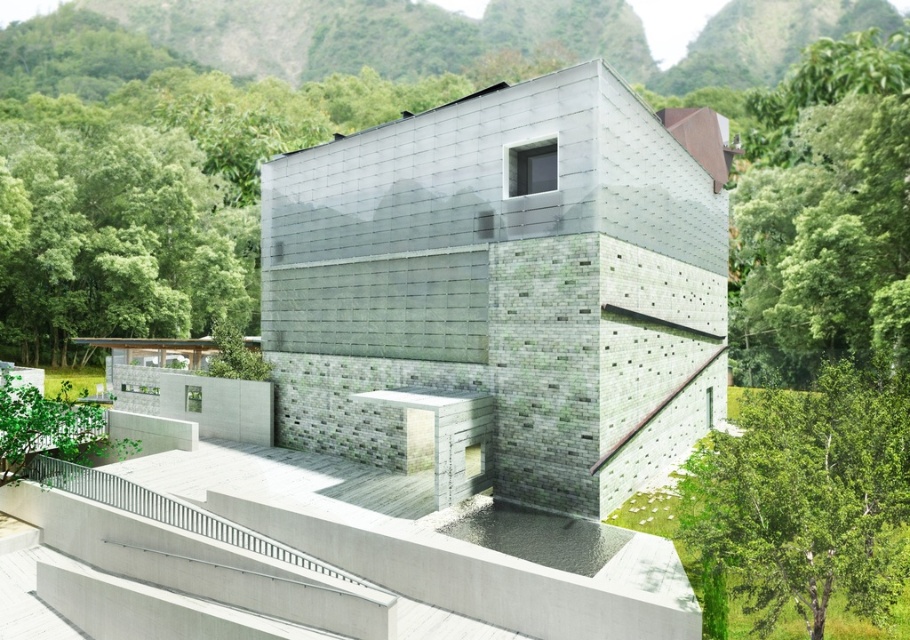
Consider the image. Can you confirm if matte concrete building at center is thinner than green leafy tree at center-right?

No, matte concrete building at center is not thinner than green leafy tree at center-right.

Consider the image. Can you confirm if matte concrete building at center is wider than green leafy tree at center-right?

Indeed, matte concrete building at center has a greater width compared to green leafy tree at center-right.

Where is `matte concrete building at center`? matte concrete building at center is located at coordinates (504, 289).

Who is more forward, (787, 228) or (871, 481)?

Point (871, 481) is in front.

Is green leafy tree at right smaller than green leafy tree at center-right?

Actually, green leafy tree at right might be larger than green leafy tree at center-right.

Measure the distance between point [861,177] and camera.

58.41 meters

Locate an element on the screen. The height and width of the screenshot is (640, 910). green leafy tree at right is located at coordinates pyautogui.click(x=825, y=211).

Is matte concrete building at center thinner than green leafy tree at right?

Yes, matte concrete building at center is thinner than green leafy tree at right.

Who is more forward, (666, 449) or (827, 64)?

Positioned in front is point (666, 449).

Identify the location of matte concrete building at center. 504,289.